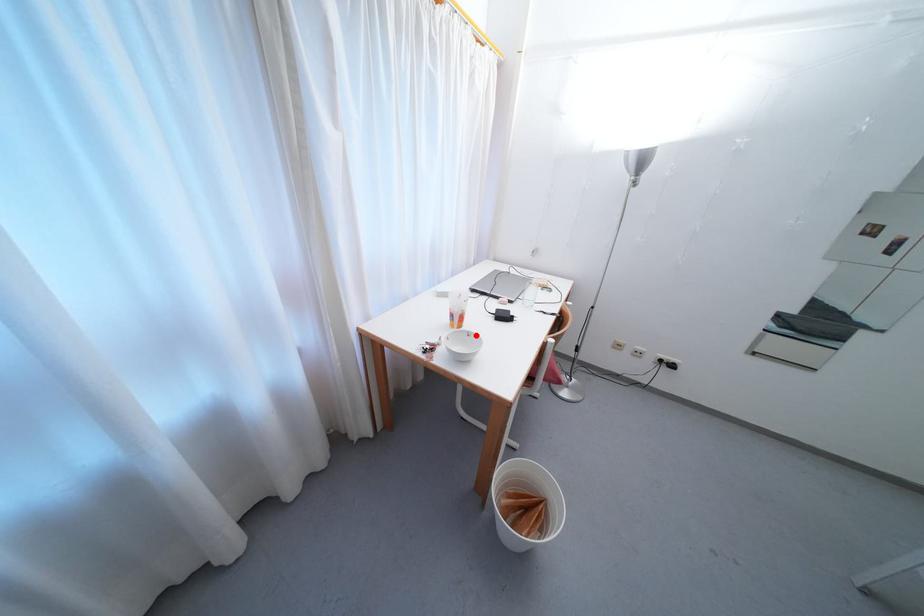
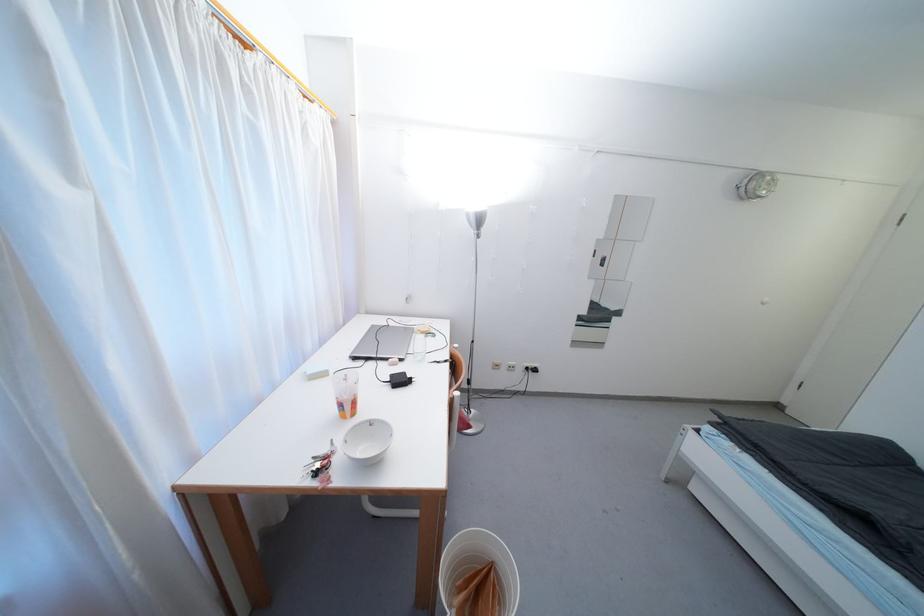
Locate, in the second image, the point that corresponds to the highlighted location in the first image.

(379, 423)